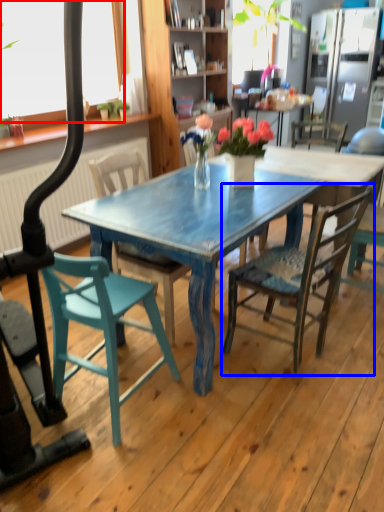
Question: Among these objects, which one is nearest to the camera, window screen (highlighted by a red box) or chair (highlighted by a blue box)?

Choices:
 (A) window screen
 (B) chair

Answer: (B)